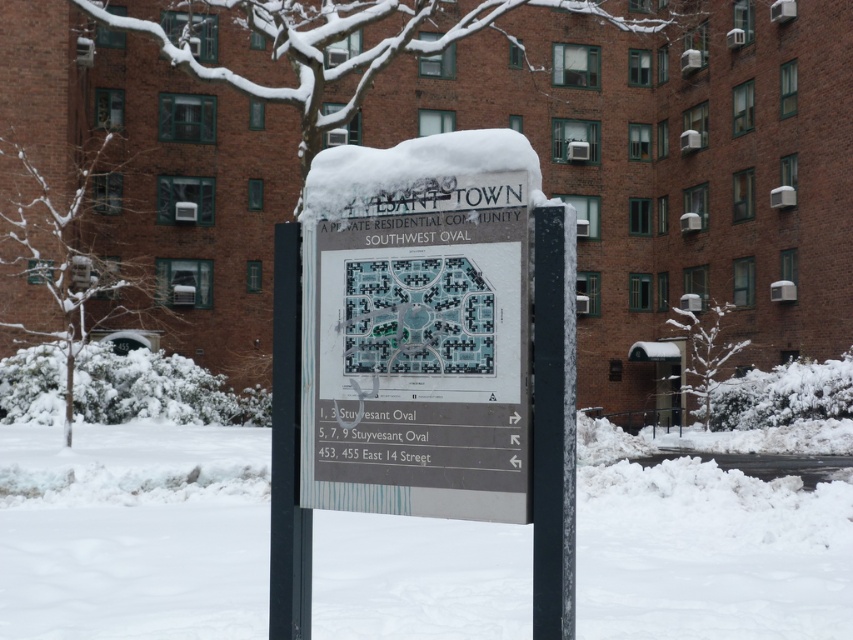
Who is shorter, white powdery snow at lower center or white plastic sign at center?

white plastic sign at center is shorter.

Consider the image. Is white powdery snow at lower center shorter than white plastic sign at center?

No.

What do you see at coordinates (132, 531) in the screenshot?
I see `white powdery snow at lower center` at bounding box center [132, 531].

Where is `white powdery snow at lower center`? Image resolution: width=853 pixels, height=640 pixels. white powdery snow at lower center is located at coordinates (132, 531).

Can you confirm if white powdery snow at lower center is positioned to the right of black metal pole at center?

Yes, white powdery snow at lower center is to the right of black metal pole at center.

Between point (712, 625) and point (299, 568), which one is positioned behind?

Point (712, 625)

In order to click on white powdery snow at lower center in this screenshot , I will do `click(132, 531)`.

Does black plastic pole at center appear on the right side of white plastic sign at center?

Indeed, black plastic pole at center is positioned on the right side of white plastic sign at center.

Is point (543, 572) closer to camera compared to point (45, 266)?

Yes, point (543, 572) is closer to viewer.

Where is `black plastic pole at center`? black plastic pole at center is located at coordinates (553, 422).